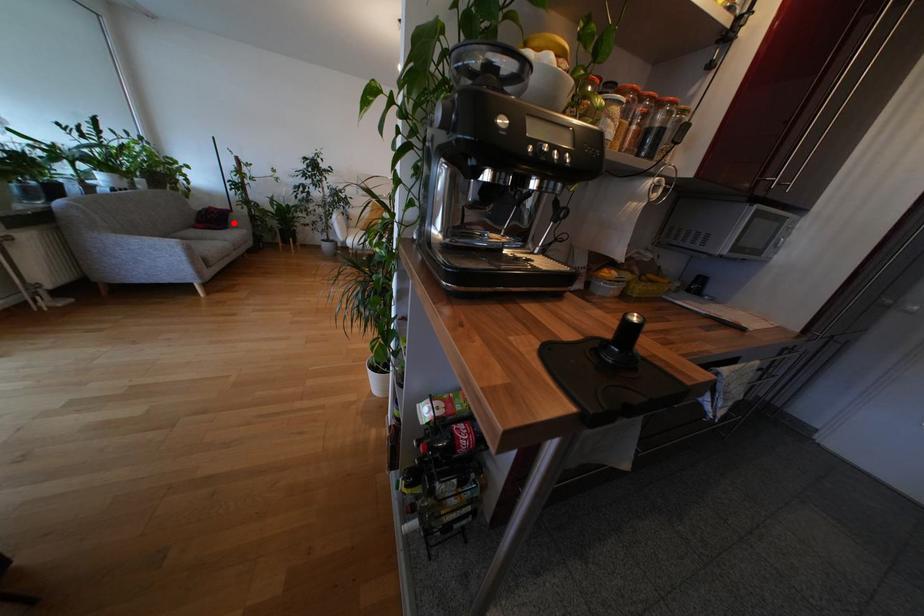
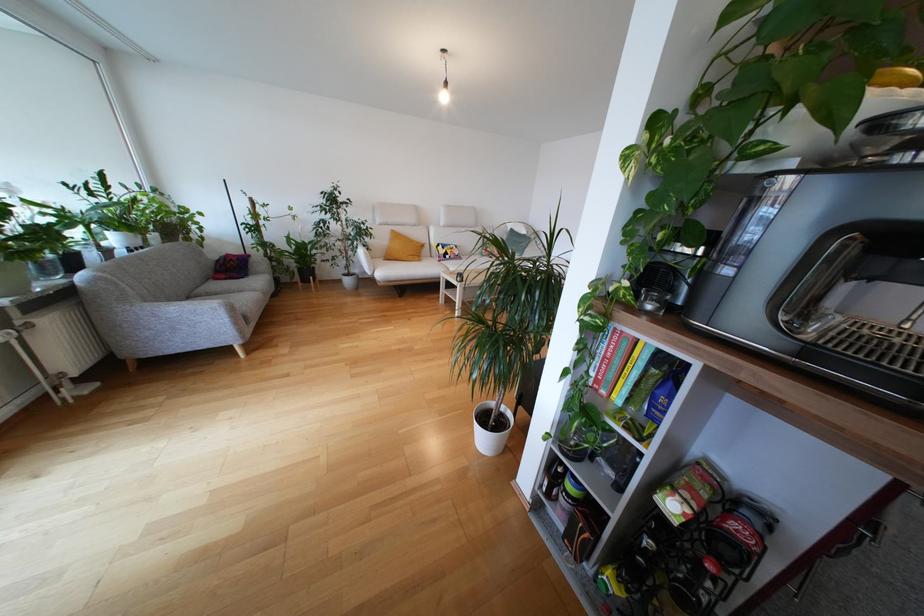
Locate, in the second image, the point that corresponds to the highlighted location in the first image.

(253, 268)